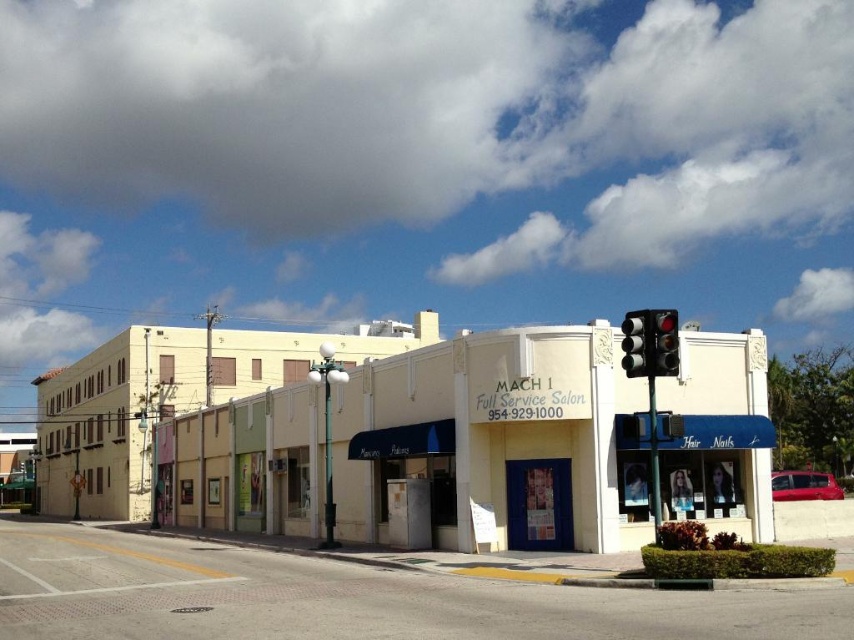
You are a delivery person who needs to deliver a package to the beige concrete mach 1 full service salon at center. You notice a red glass traffic light at upper right nearby. Which object is taller?

The beige concrete mach 1 full service salon at center is taller than the red glass traffic light at upper right according to the description.

You are a delivery driver trying to park your vehicle between the two traffic lights on the street. The width of your vehicle is 2 meters. Can you fit your vehicle between the metallic traffic light at upper right and the red glass traffic light at upper right?

The metallic traffic light at upper right has a lesser width compared to red glass traffic light at upper right. However, the question is about fitting a vehicle between them based on their widths. Since the description only compares their widths, not the distance between them, there is insufficient information to determine if the vehicle can fit. The width of the traffic lights themselves doesn not indicate the space between them.

You are standing at the point with coordinates point (496, 442). Which building are you in front of?

You are in front of the beige concrete mach 1 full service salon at center located at point (496, 442).